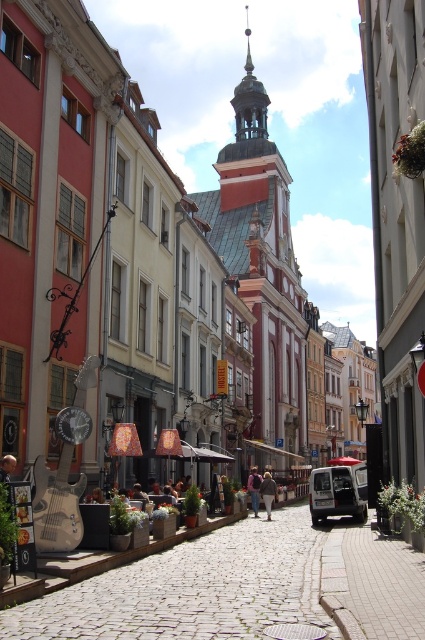
You are a tourist standing in the middle of the cobblestone alley at center and want to pick up the brown leather jacket at center. Can you reach it without stepping out of the alley?

The cobblestone alley at center is positioned over the brown leather jacket at center, meaning the jacket is underneath the alley. Since you are standing in the alley, you can reach down to pick up the brown leather jacket at center without needing to step out of the alley.

You are standing at the entrance of the street and want to walk straight ahead. Will the cobblestone alley at center be in your path? Please explain your reasoning based on the coordinates provided.

The cobblestone alley at center is located at coordinates point [240,588], which is in the central area of the image. Since you are walking straight ahead from the entrance, the cobblestone alley at center will indeed be in your path as it is positioned centrally in the scene.